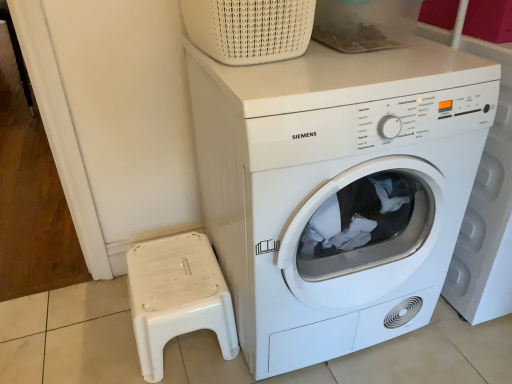
This screenshot has width=512, height=384. What do you see at coordinates (177, 297) in the screenshot?
I see `white plastic stool at lower left` at bounding box center [177, 297].

Locate an element on the screen. This screenshot has height=384, width=512. white matte washing machine at center is located at coordinates (337, 190).

This screenshot has height=384, width=512. Describe the element at coordinates (337, 190) in the screenshot. I see `white matte washing machine at center` at that location.

Describe the element at coordinates (249, 29) in the screenshot. I see `white woven basket at upper center` at that location.

Locate an element on the screen. The height and width of the screenshot is (384, 512). white plastic stool at lower left is located at coordinates (177, 297).

Which object is further away from the camera, white plastic stool at lower left or white matte washing machine at center?

white plastic stool at lower left is further away from the camera.

Does white plastic stool at lower left appear on the left side of white matte washing machine at center?

Yes, white plastic stool at lower left is to the left of white matte washing machine at center.

Is white plastic stool at lower left looking in the opposite direction of white matte washing machine at center?

No, white plastic stool at lower left's orientation is not away from white matte washing machine at center.

Which point is more distant from viewer, (203, 247) or (249, 62)?

The point (203, 247) is behind.

In the scene shown: In the image, is white plastic stool at lower left positioned in front of or behind white woven basket at upper center?

white plastic stool at lower left is behind white woven basket at upper center.

Is white plastic stool at lower left not close to white woven basket at upper center?

No, white plastic stool at lower left is not far from white woven basket at upper center.

Is white plastic stool at lower left taller or shorter than white woven basket at upper center?

Considering their sizes, white plastic stool at lower left has more height than white woven basket at upper center.

Which of these two, white woven basket at upper center or white plastic stool at lower left, is thinner?

Thinner between the two is white plastic stool at lower left.

Between point (230, 3) and point (220, 299), which one is positioned behind?

The point (220, 299) is more distant.

The height and width of the screenshot is (384, 512). In order to click on music stool below the white woven basket at upper center (from a real-world perspective) in this screenshot , I will do `click(177, 297)`.

Are white woven basket at upper center and white plastic stool at lower left far apart?

No, there isn't a large distance between white woven basket at upper center and white plastic stool at lower left.

Considering the sizes of objects white matte washing machine at center and white woven basket at upper center in the image provided, who is smaller, white matte washing machine at center or white woven basket at upper center?

Smaller between the two is white woven basket at upper center.

Is white matte washing machine at center facing away from white woven basket at upper center?

No, white woven basket at upper center is not at the back of white matte washing machine at center.

Does white matte washing machine at center touch white woven basket at upper center?

No.

Where is `washing machine directly beneath the white woven basket at upper center (from a real-world perspective)`? Image resolution: width=512 pixels, height=384 pixels. washing machine directly beneath the white woven basket at upper center (from a real-world perspective) is located at coordinates (337, 190).

Would you say white woven basket at upper center is a long distance from white matte washing machine at center?

Actually, white woven basket at upper center and white matte washing machine at center are a little close together.

Which object is thinner, white woven basket at upper center or white matte washing machine at center?

white woven basket at upper center is thinner.

Is white woven basket at upper center looking in the opposite direction of white matte washing machine at center?

No, white woven basket at upper center is not facing the opposite direction of white matte washing machine at center.

Is white woven basket at upper center further to the viewer compared to white matte washing machine at center?

Yes, it is behind white matte washing machine at center.

Who is smaller, white matte washing machine at center or white plastic stool at lower left?

Smaller between the two is white plastic stool at lower left.

From a real-world perspective, is white matte washing machine at center under white plastic stool at lower left?

Actually, white matte washing machine at center is physically above white plastic stool at lower left in the real world.

Does white matte washing machine at center contain white plastic stool at lower left?

No, white plastic stool at lower left is not inside white matte washing machine at center.

Locate an element on the screen. music stool on the left of white matte washing machine at center is located at coordinates (177, 297).

This screenshot has width=512, height=384. I want to click on basket in front of the white plastic stool at lower left, so click(249, 29).

Looking at the image, which one is located further to white plastic stool at lower left, white woven basket at upper center or white matte washing machine at center?

white woven basket at upper center is positioned further to the anchor white plastic stool at lower left.

Based on their spatial positions, is white matte washing machine at center or white woven basket at upper center further from white plastic stool at lower left?

white woven basket at upper center is positioned further to the anchor white plastic stool at lower left.

Which object lies further to the anchor point white matte washing machine at center, white woven basket at upper center or white plastic stool at lower left?

Among the two, white plastic stool at lower left is located further to white matte washing machine at center.

Estimate the real-world distances between objects in this image. Which object is closer to white woven basket at upper center, white plastic stool at lower left or white matte washing machine at center?

The object closer to white woven basket at upper center is white matte washing machine at center.

Considering their positions, is white plastic stool at lower left positioned further to white matte washing machine at center than white woven basket at upper center?

white plastic stool at lower left is further to white matte washing machine at center.

When comparing their distances from white woven basket at upper center, does white matte washing machine at center or white plastic stool at lower left seem closer?

white matte washing machine at center lies closer to white woven basket at upper center than the other object.

I want to click on washing machine between white woven basket at upper center and white plastic stool at lower left in the up-down direction, so click(x=337, y=190).